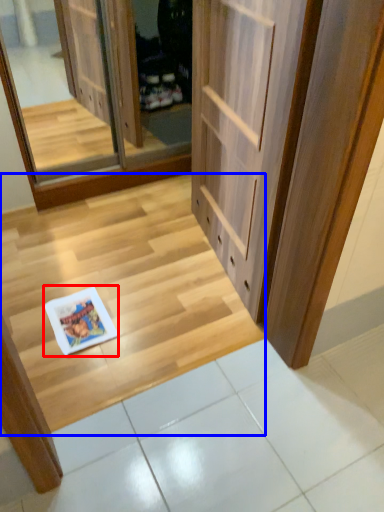
Question: Which object is closer to the camera taking this photo, magazine (highlighted by a red box) or stairwell (highlighted by a blue box)?

Choices:
 (A) magazine
 (B) stairwell

Answer: (B)